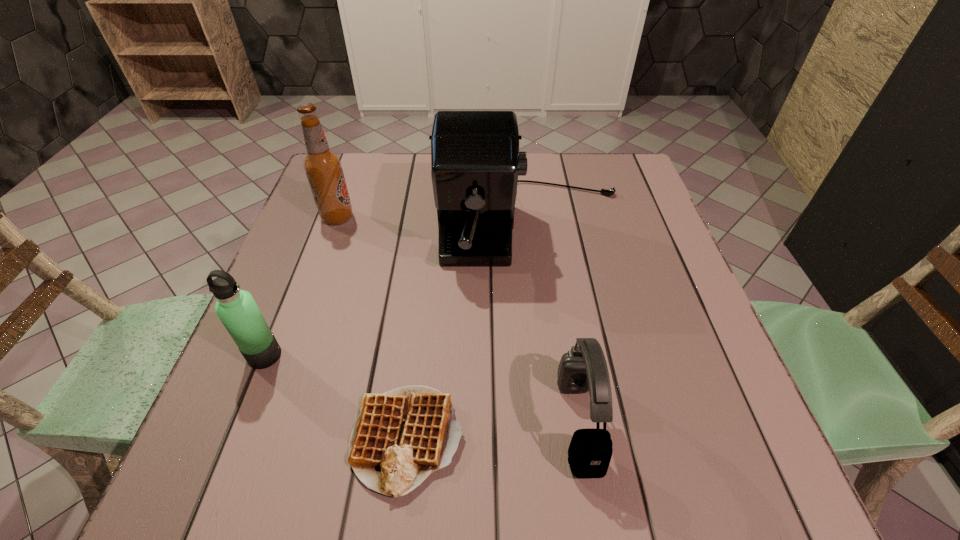
Where is `vacant area at the far edge`? The height and width of the screenshot is (540, 960). vacant area at the far edge is located at coordinates (564, 193).

Locate an element on the screen. The width and height of the screenshot is (960, 540). vacant space at the left edge is located at coordinates (265, 420).

The image size is (960, 540). I want to click on vacant space at the right edge of the desktop, so click(627, 276).

Find the location of a particular element. This screenshot has width=960, height=540. free space at the far left corner of the desktop is located at coordinates click(358, 185).

At what (x,y) coordinates should I click in order to perform the action: click on vacant space at the far right corner of the desktop. Please return your answer as a coordinate pair (x, y). Looking at the image, I should click on (579, 155).

The width and height of the screenshot is (960, 540). I want to click on empty space that is in between the beer bottle and the headset, so click(x=458, y=320).

Image resolution: width=960 pixels, height=540 pixels. In order to click on empty location between the thermos bottle and the shortest object in this screenshot , I will do `click(336, 397)`.

I want to click on free space that is in between the third nearest object and the beer bottle, so pyautogui.click(x=301, y=287).

The height and width of the screenshot is (540, 960). I want to click on vacant space that's between the second shortest object and the coffee maker, so click(555, 325).

Locate an element on the screen. The height and width of the screenshot is (540, 960). free space between the waffle and the third farthest object is located at coordinates (336, 397).